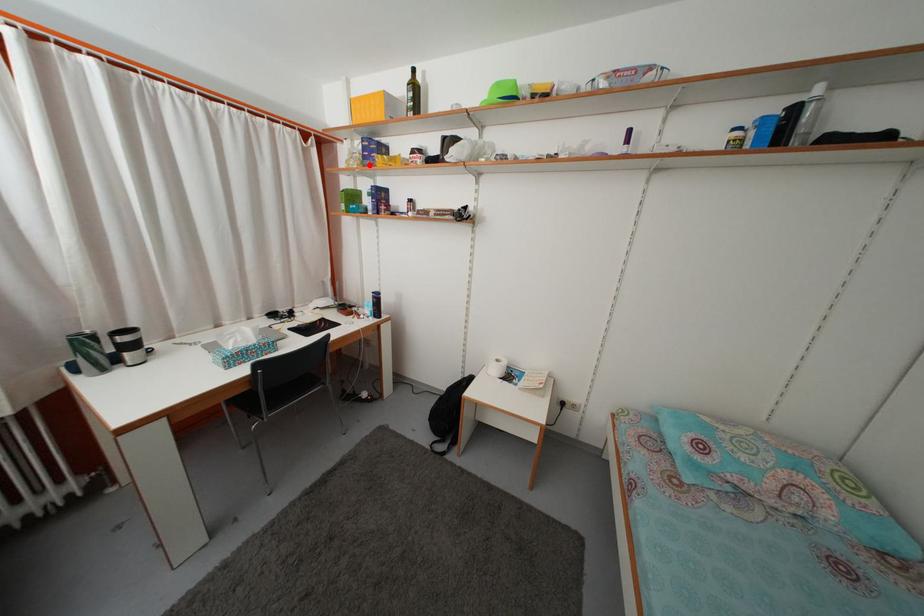
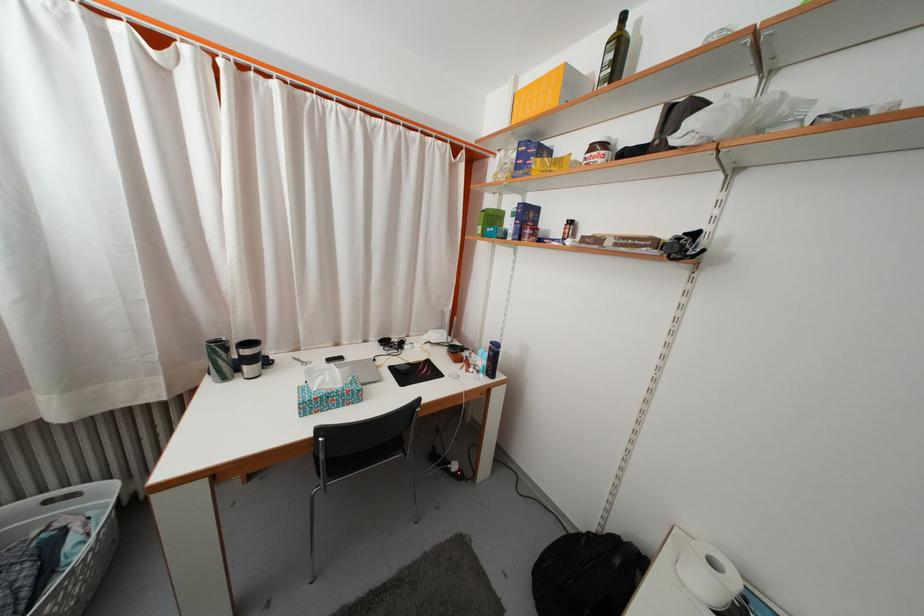
Find the pixel in the second image that matches the highlighted location in the first image.

(523, 175)